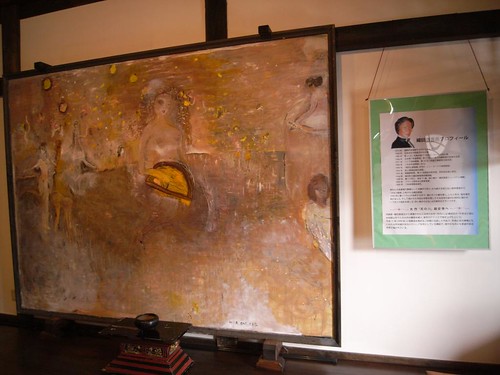
Where is `wood picture frame`? This screenshot has height=375, width=500. wood picture frame is located at coordinates (336, 241).